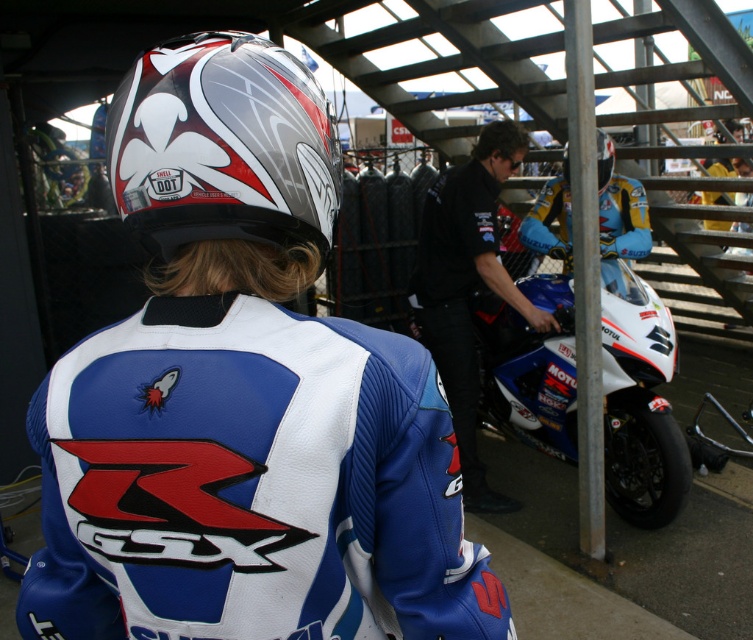
Question: Does white and blue leather jacket at center appear over black leather jacket at center?

Choices:
 (A) no
 (B) yes

Answer: (A)

Question: Among these points, which one is nearest to the camera?

Choices:
 (A) (465, 294)
 (B) (236, 128)
 (C) (633, 490)
 (D) (596, 140)

Answer: (B)

Question: Can you confirm if white glossy motorcycle at center is thinner than black leather jacket at center?

Choices:
 (A) no
 (B) yes

Answer: (A)

Question: In this image, where is shiny silver helmet at upper center located relative to glossy white helmet at upper center?

Choices:
 (A) below
 (B) above

Answer: (A)

Question: Which point is closer to the camera?

Choices:
 (A) (630, 301)
 (B) (114, 192)

Answer: (B)

Question: Which of the following is the closest to the observer?

Choices:
 (A) glossy white helmet at upper center
 (B) white glossy motorcycle at center

Answer: (B)